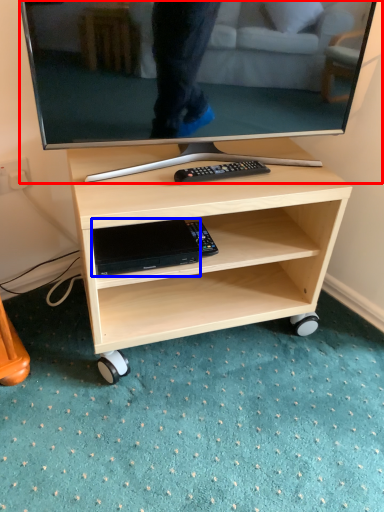
Question: Which of the following is the farthest to the observer, television (highlighted by a red box) or gadget (highlighted by a blue box)?

Choices:
 (A) television
 (B) gadget

Answer: (B)